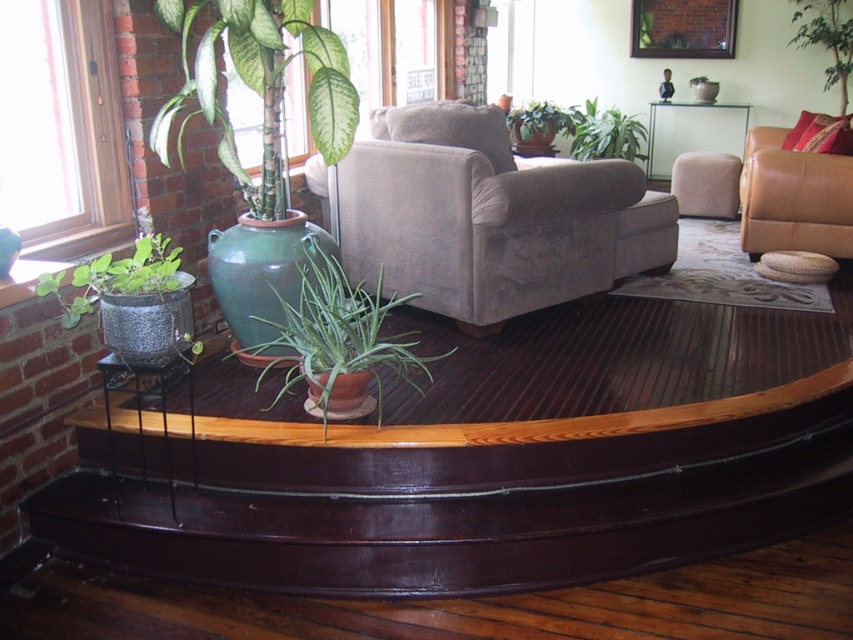
Question: Which object is positioned closest to the white glossy table at upper center?

Choices:
 (A) green textured pot at lower left
 (B) green leafy plant at upper center
 (C) velvet beige armchair at center

Answer: (B)

Question: Which of the following is the closest to the observer?

Choices:
 (A) velvet beige armchair at center
 (B) green clay pot at center

Answer: (B)

Question: Does green glossy vase at upper left come in front of green clay pot at center?

Choices:
 (A) yes
 (B) no

Answer: (B)

Question: Where is velvet beige armchair at center located in relation to green leafy plant at upper center in the image?

Choices:
 (A) right
 (B) left

Answer: (B)

Question: Which point appears closest to the camera in this image?

Choices:
 (A) (x=590, y=140)
 (B) (x=553, y=132)
 (C) (x=282, y=72)
 (D) (x=811, y=44)

Answer: (C)

Question: Is the position of brown leather couch at upper right more distant than that of green matte plant at center?

Choices:
 (A) no
 (B) yes

Answer: (A)